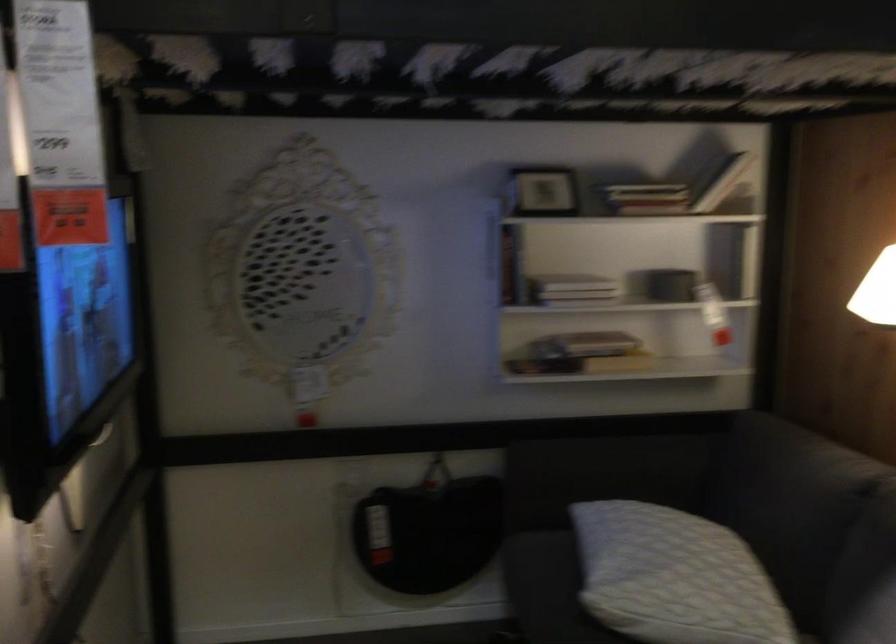
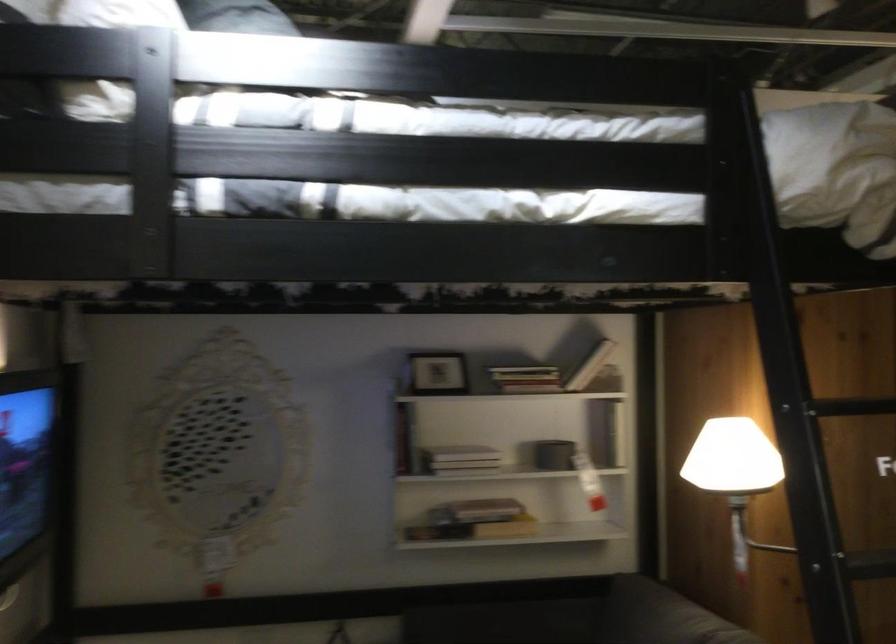
In the second image, find the point that corresponds to (x=586, y=341) in the first image.

(476, 511)